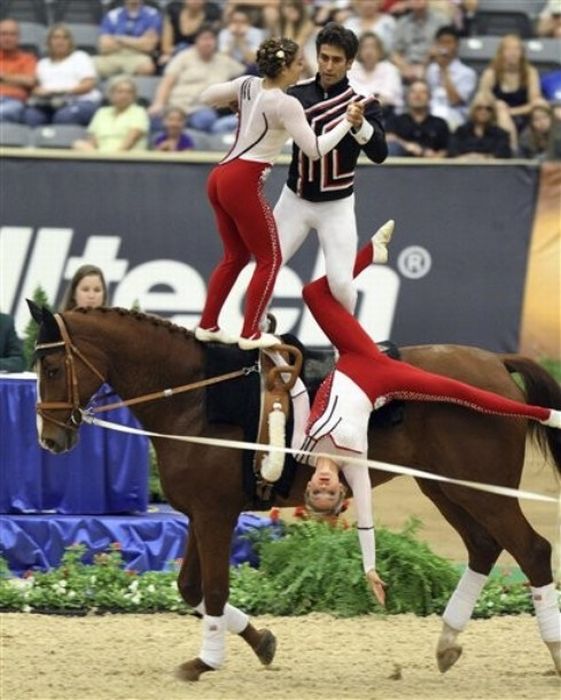
Identify the location of the left front leg. Image resolution: width=561 pixels, height=700 pixels. (538, 606).